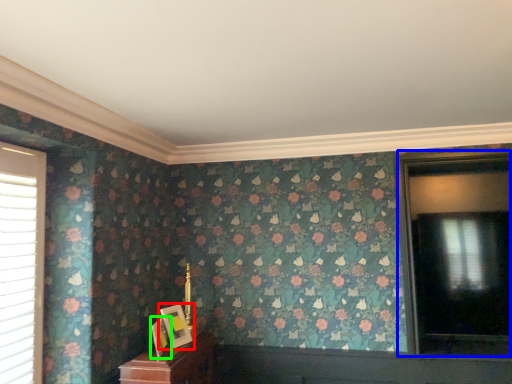
Question: Which is farther away from picture frame (highlighted by a red box)? window (highlighted by a blue box) or picture frame (highlighted by a green box)?

Choices:
 (A) window
 (B) picture frame

Answer: (A)